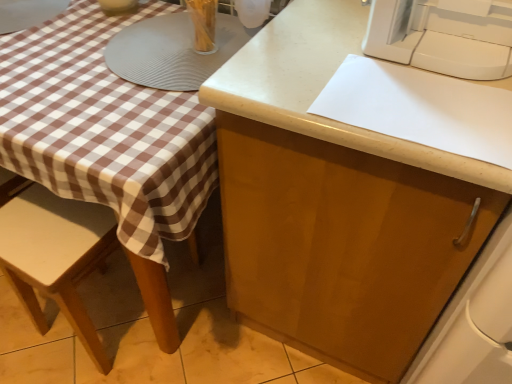
Identify the location of free location to the right of wooden chair at lower left. Image resolution: width=512 pixels, height=384 pixels. (189, 319).